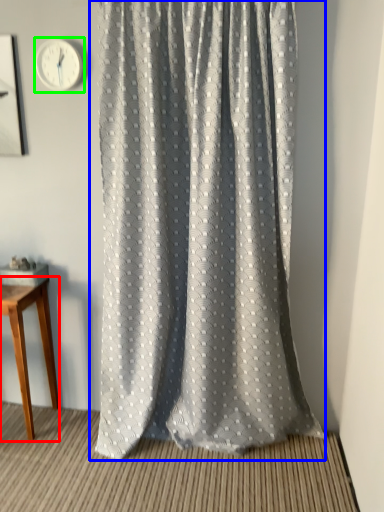
Question: Considering the real-world distances, which object is closest to table (highlighted by a red box)? curtain (highlighted by a blue box) or clock (highlighted by a green box).

Choices:
 (A) curtain
 (B) clock

Answer: (A)